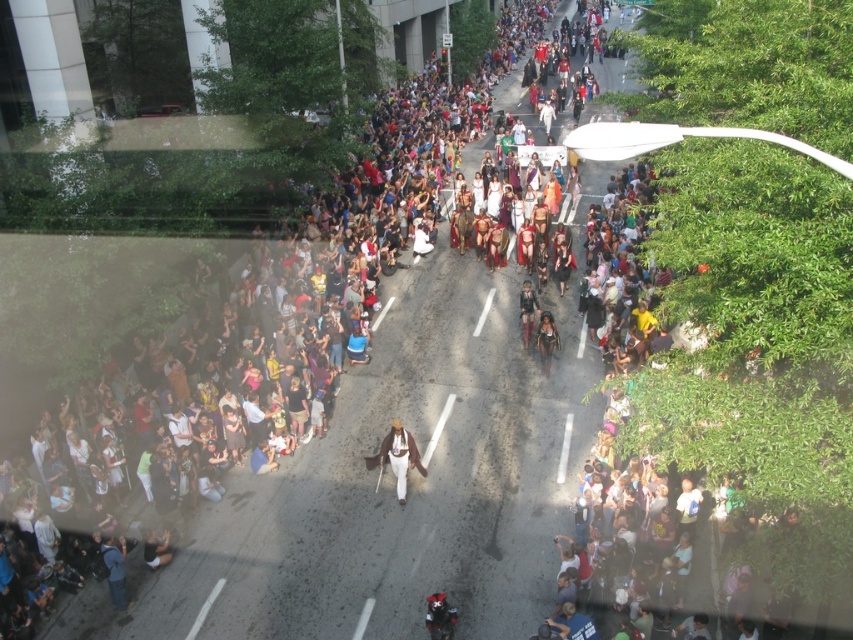
Between point (430, 604) and point (549, 330), which one is positioned behind?

The point (549, 330) is behind.

Is black leather motorcycle at center bigger than leather-like costume at center?

No, black leather motorcycle at center is not bigger than leather-like costume at center.

What do you see at coordinates (439, 616) in the screenshot?
I see `black leather motorcycle at center` at bounding box center [439, 616].

This screenshot has width=853, height=640. I want to click on black leather motorcycle at center, so click(439, 616).

Who is lower down, white fur coat at center or black leather motorcycle at center?

black leather motorcycle at center is lower down.

Which of these two, white fur coat at center or black leather motorcycle at center, stands taller?

white fur coat at center is taller.

Is point (399, 484) less distant than point (445, 630)?

That is False.

Where is `white fur coat at center`? The width and height of the screenshot is (853, 640). white fur coat at center is located at coordinates (399, 456).

Which is below, white fur coat at center or leather-like costume at center?

Positioned lower is white fur coat at center.

This screenshot has width=853, height=640. Describe the element at coordinates (399, 456) in the screenshot. I see `white fur coat at center` at that location.

The width and height of the screenshot is (853, 640). What are the coordinates of `white fur coat at center` in the screenshot? It's located at (399, 456).